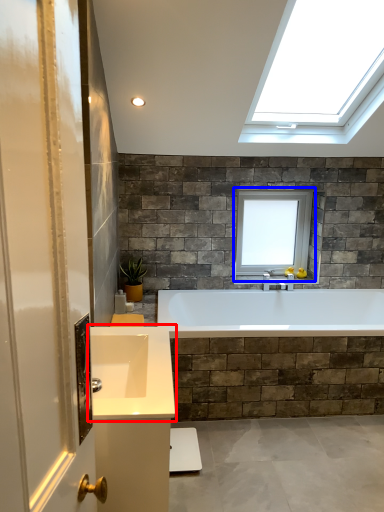
Question: Among these objects, which one is nearest to the camera, sink (highlighted by a red box) or window (highlighted by a blue box)?

Choices:
 (A) sink
 (B) window

Answer: (A)